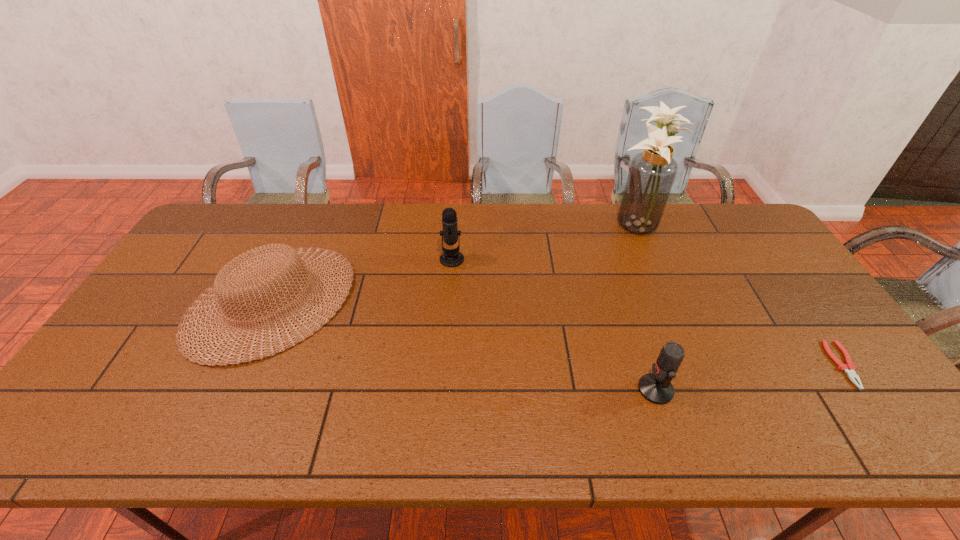
You are a GUI agent. You are given a task and a screenshot of the screen. Output one action in this format:
    pyautogui.click(x=<x>, y=<y>)
    Task: Click on the farthest object
    
    Given the screenshot: What is the action you would take?
    pyautogui.click(x=652, y=172)

Where is `the tallest object`? the tallest object is located at coordinates (652, 172).

Find the location of `the farther microphone`. the farther microphone is located at coordinates (450, 258).

You are a GUI agent. You are given a task and a screenshot of the screen. Output one action in this format:
    pyautogui.click(x=<x>, y=<y>)
    Task: Click on the left microphone
    
    Given the screenshot: What is the action you would take?
    pyautogui.click(x=450, y=258)

Identify the location of the nearer microphone. This screenshot has width=960, height=540. (656, 387).

The height and width of the screenshot is (540, 960). I want to click on the shorter microphone, so click(x=656, y=387).

Locate an element on the screen. sunhat is located at coordinates (244, 274).

Find the location of a particular element. The image size is (960, 540). the second shortest object is located at coordinates (244, 274).

The height and width of the screenshot is (540, 960). I want to click on the shortest object, so click(x=849, y=368).

The height and width of the screenshot is (540, 960). I want to click on the rightmost object, so click(x=849, y=368).